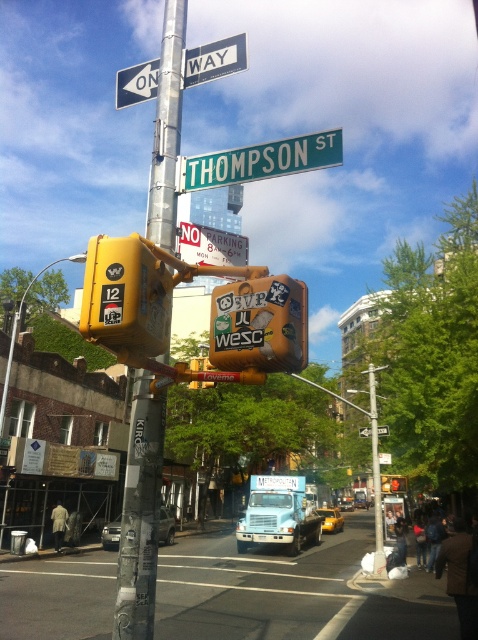
Looking at this image, you are a delivery driver who needs to park your van between the orange fabric traffic light at center and the yellow plastic traffic light at center. The van is 20 feet long. Is there enough space between them to park?

The distance between the orange fabric traffic light at center and the yellow plastic traffic light at center is 40.86 feet. Since the van is 20 feet long, there is sufficient space to park between them as the distance is more than double the van length.

You are a city planner assessing the street layout. You need to install a new rectangular advertisement board that is 1.2 meters wide. The board must be placed on either the metallic pole at center or the yellow plastic traffic light at center. Based on their widths, which object can accommodate the board without exceeding its width?

The metallic pole at center has a greater width than the yellow plastic traffic light at center. Since the advertisement board is 1.2 meters wide, it can be placed on the metallic pole at center as its width is sufficient to support it.

You are a city planner assessing the street layout. You need to install a new streetlight that must be taller than the existing yellow plastic traffic light at center. Can the metallic pole at center accommodate this requirement?

The metallic pole at center has a greater height compared to the yellow plastic traffic light at center, so yes, the metallic pole at center can accommodate the new streetlight installation as it meets the height requirement.